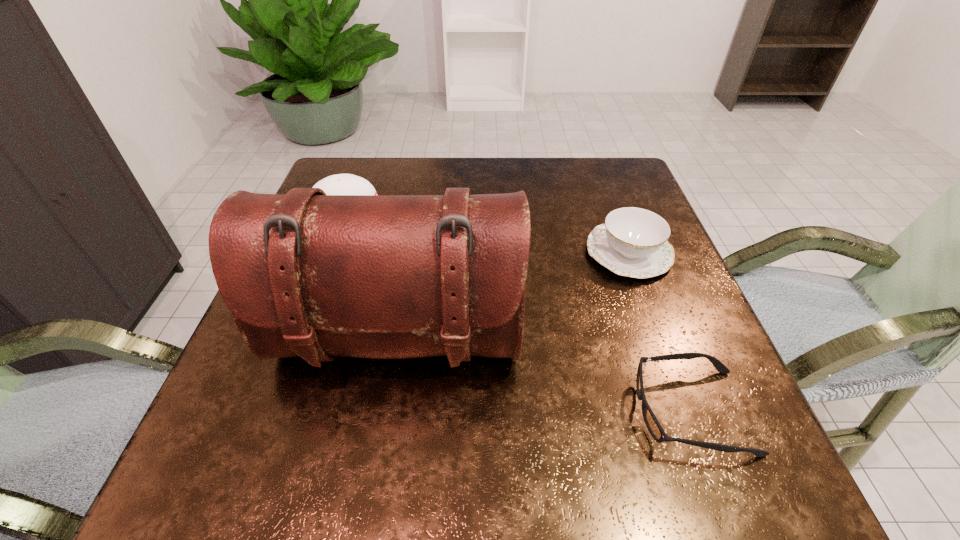
Locate an element on the screen. free space at the far edge of the desktop is located at coordinates click(522, 161).

The width and height of the screenshot is (960, 540). I want to click on vacant space at the left edge, so click(324, 368).

Locate an element on the screen. This screenshot has width=960, height=540. free space at the near left corner of the desktop is located at coordinates (226, 490).

Identify the location of vacant space at the far right corner of the desktop. The height and width of the screenshot is (540, 960). (583, 160).

This screenshot has height=540, width=960. In the image, there is a desktop. What are the coordinates of `free space at the near right corner` in the screenshot? It's located at (752, 480).

Where is `vacant point located between the third tallest object and the shortest object`? This screenshot has height=540, width=960. vacant point located between the third tallest object and the shortest object is located at coordinates (660, 332).

Locate an element on the screen. This screenshot has height=540, width=960. unoccupied position between the spectacles and the chinaware is located at coordinates (660, 332).

Where is `free space that is in between the shortest object and the tallest object`? The height and width of the screenshot is (540, 960). free space that is in between the shortest object and the tallest object is located at coordinates (545, 376).

The height and width of the screenshot is (540, 960). I want to click on free space between the shortest object and the chinaware, so click(x=660, y=332).

Where is `free space between the third shortest object and the spectacles`? free space between the third shortest object and the spectacles is located at coordinates (525, 314).